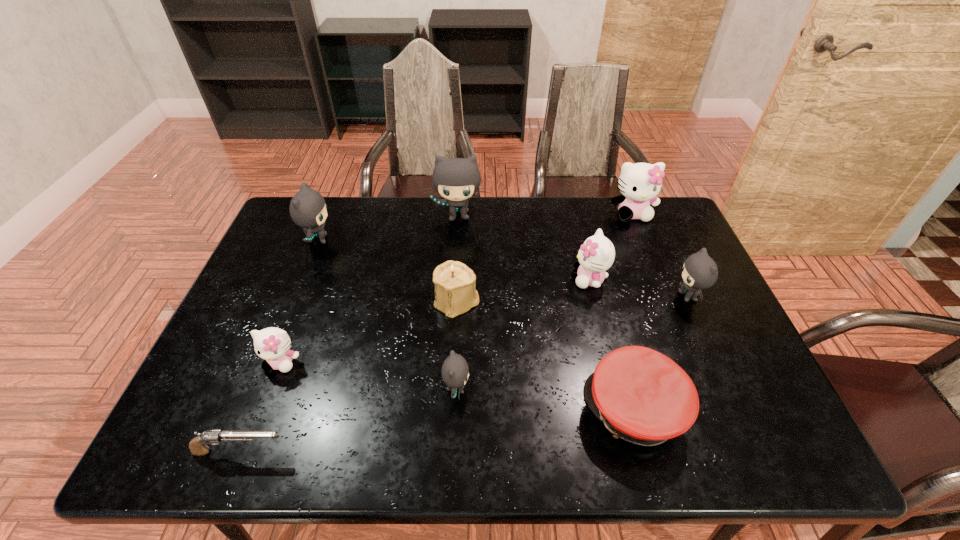
You are a GUI agent. You are given a task and a screenshot of the screen. Output one action in this format:
    pyautogui.click(x=<x>, y=<y>)
    Task: Click on the free space between the red cap and the gun
    This screenshot has width=960, height=540.
    Given the screenshot: What is the action you would take?
    pyautogui.click(x=437, y=431)

Identify the location of the sixth closest object to the nearest gray kitten. (308, 209).

Identify the location of object that stands as the fourth closest to the fifth kitten from left to right. (455, 289).

Find the location of `kitten that is the second closest one to the shortest object`. kitten that is the second closest one to the shortest object is located at coordinates (455, 371).

This screenshot has width=960, height=540. What are the coordinates of `kitten that is the third closest to the candle_holder` in the screenshot? It's located at (596, 255).

Identify which gray kitten is the fourth nearest to the shortest object. Please provide its 2D coordinates. Your answer should be formatted as a tuple, i.e. [(x, y)], where the tuple contains the x and y coordinates of a point satisfying the conditions above.

[(700, 271)]

In order to click on gray kitten that is the third nearest to the second white kitten from left to right in this screenshot , I will do `click(455, 371)`.

Find the location of a particular element. the closest white kitten to the third biggest gray kitten is located at coordinates (596, 255).

This screenshot has width=960, height=540. In order to click on white kitten that stands as the second closest to the second farthest white kitten in this screenshot , I will do `click(273, 344)`.

At what (x,y) coordinates should I click in order to perform the action: click on free space that satisfies the following two spatial constraints: 1. on the back side of the candle_holder; 2. on the front-facing side of the second biggest gray kitten. Please return your answer as a coordinate pair (x, y). This screenshot has width=960, height=540. Looking at the image, I should click on (460, 240).